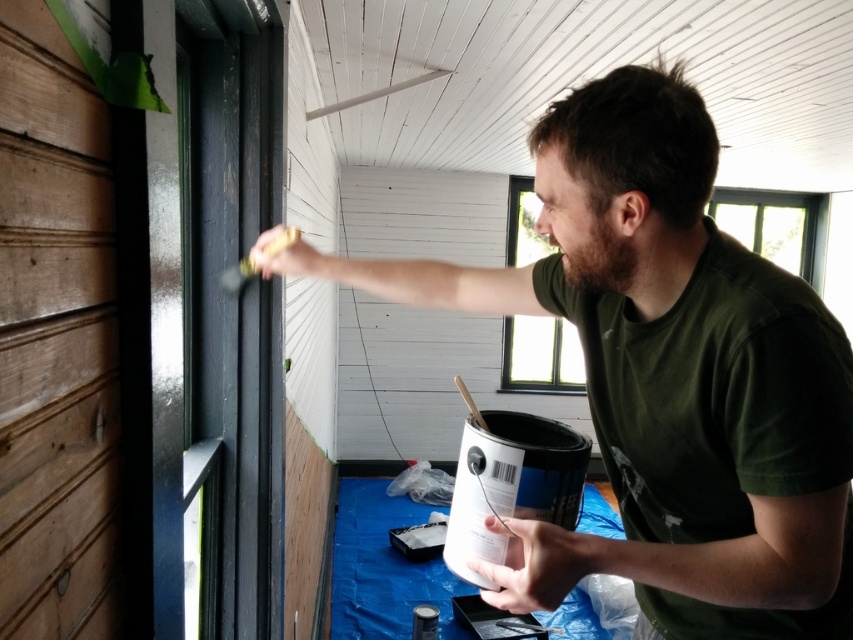
You are standing at the point where the person is painting. You want to place a ladder so that it is exactly 3 feet away from your current position. Is the point at coordinates point (627,67) within the ladder placement area? Please answer based on the distance between the point and the viewer.

The distance between point (627,67) and the viewer is 32.98 inches. Since 32.98 inches is approximately 2.75 feet, which is less than 3 feet, the point at coordinates point (627,67) is within the ladder placement area.